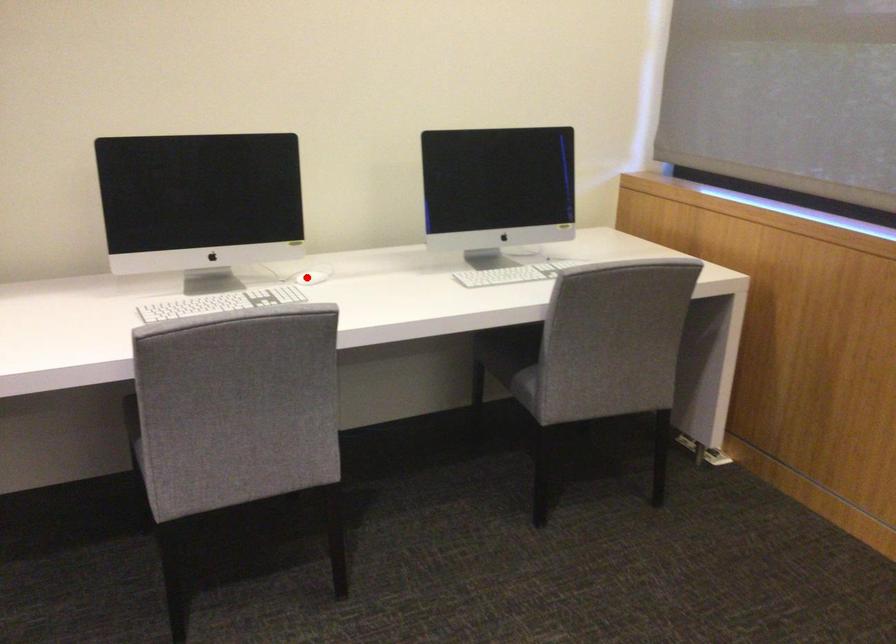
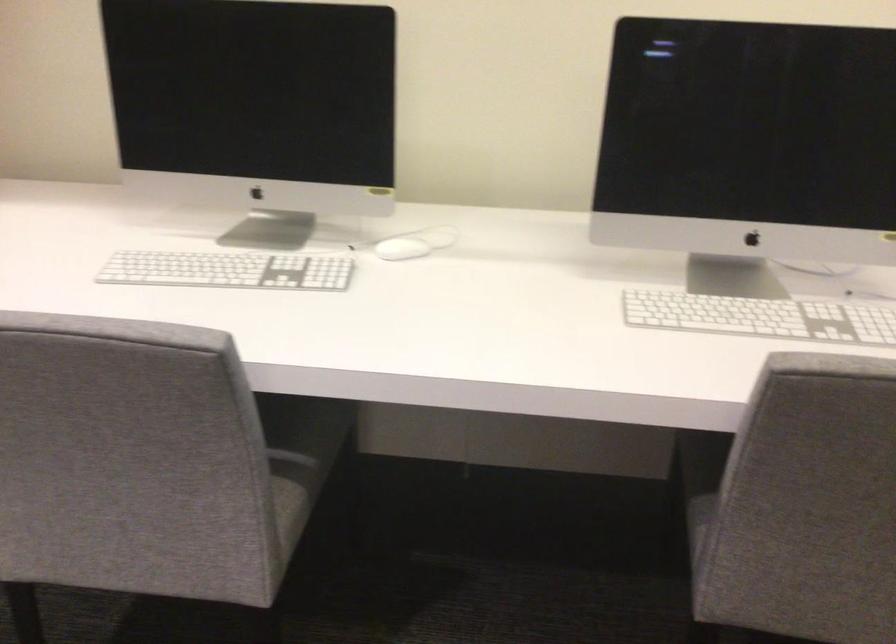
Question: I am providing you with two images of the same scene from different viewpoints. A red point is shown in image1. For the corresponding object point in image2, is it positioned nearer or farther from the camera?

Choices:
 (A) Nearer
 (B) Farther

Answer: (A)